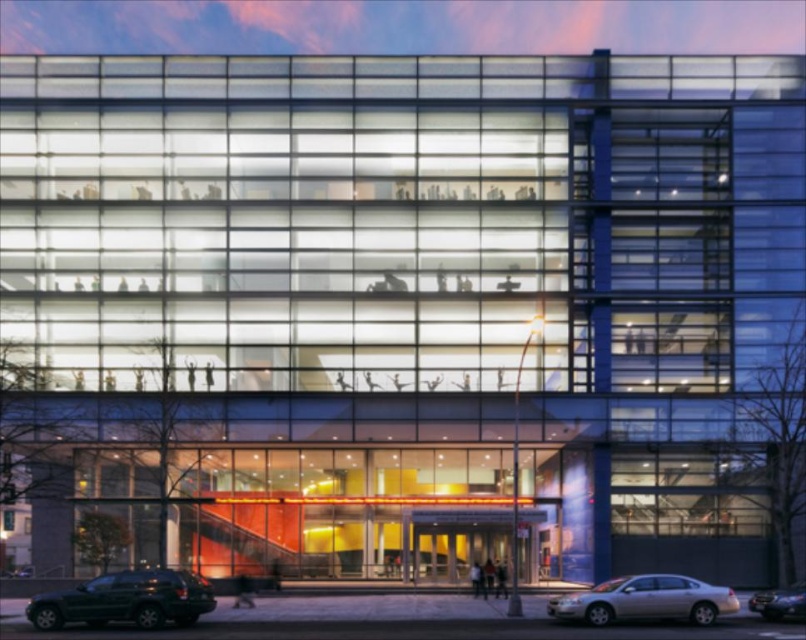
Question: Among these objects, which one is nearest to the camera?

Choices:
 (A) shiny dark green suv at lower left
 (B) shiny silver sedan at lower right
 (C) silver metallic sedan at lower right

Answer: (C)

Question: Does shiny dark green suv at lower left appear on the left side of shiny silver sedan at lower right?

Choices:
 (A) yes
 (B) no

Answer: (A)

Question: Which point is farther to the camera?

Choices:
 (A) (588, 602)
 (B) (775, 609)
 (C) (154, 570)

Answer: (C)

Question: Does shiny dark green suv at lower left have a smaller size compared to shiny silver sedan at lower right?

Choices:
 (A) no
 (B) yes

Answer: (A)

Question: Considering the real-world distances, which object is farthest from the shiny silver sedan at lower right?

Choices:
 (A) silver metallic sedan at lower right
 (B) shiny dark green suv at lower left

Answer: (B)

Question: Does shiny dark green suv at lower left appear on the left side of silver metallic sedan at lower right?

Choices:
 (A) yes
 (B) no

Answer: (A)